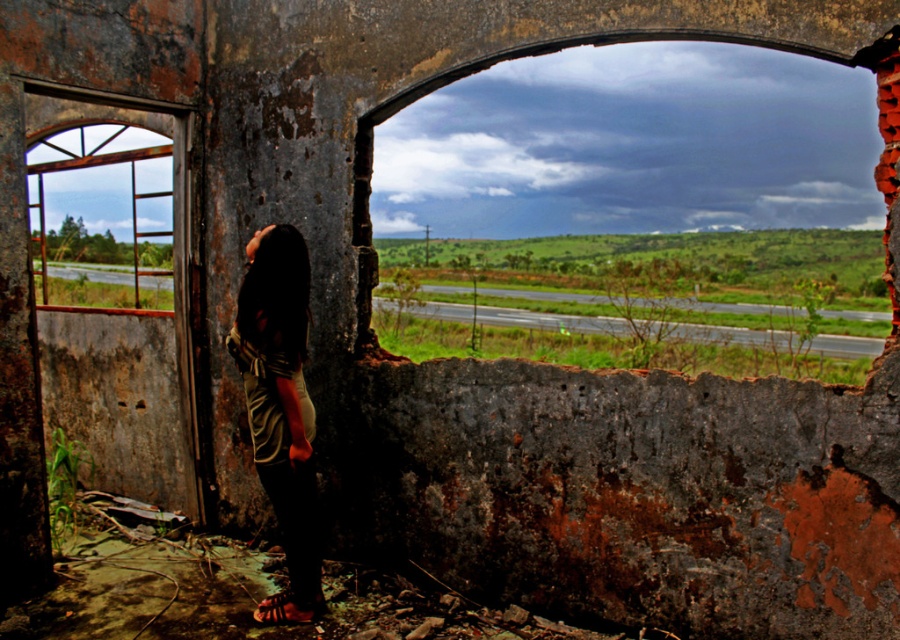
Between point (109, 124) and point (261, 612), which one is positioned in front?

Positioned in front is point (261, 612).

Is rusty metal window at left wider than leather sandal at lower center?

Indeed, rusty metal window at left has a greater width compared to leather sandal at lower center.

What do you see at coordinates (106, 188) in the screenshot? I see `rusty metal window at left` at bounding box center [106, 188].

Identify the location of rusty metal window at left. (106, 188).

Does dark brown fabric dress at center appear under leather sandal at lower center?

Incorrect, dark brown fabric dress at center is not positioned below leather sandal at lower center.

Describe the element at coordinates (280, 406) in the screenshot. The height and width of the screenshot is (640, 900). I see `dark brown fabric dress at center` at that location.

Who is more distant from viewer, (x=294, y=440) or (x=259, y=605)?

Point (x=259, y=605)

This screenshot has height=640, width=900. I want to click on dark brown fabric dress at center, so click(280, 406).

Is rusty concrete arch at upper center positioned before dark brown fabric dress at center?

No, rusty concrete arch at upper center is behind dark brown fabric dress at center.

Based on the photo, is rusty concrete arch at upper center above dark brown fabric dress at center?

Yes, rusty concrete arch at upper center is above dark brown fabric dress at center.

Who is more forward, [587,109] or [270,484]?

Positioned in front is point [270,484].

Locate an element on the screen. Image resolution: width=900 pixels, height=640 pixels. rusty concrete arch at upper center is located at coordinates pos(633,145).